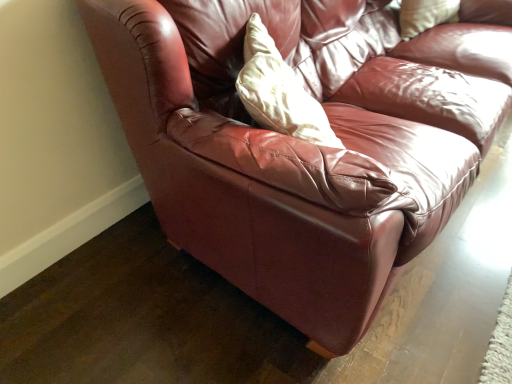
What do you see at coordinates (425, 15) in the screenshot? I see `white soft pillow at upper right` at bounding box center [425, 15].

You are a GUI agent. You are given a task and a screenshot of the screen. Output one action in this format:
    pyautogui.click(x=<x>, y=<y>)
    Task: Click on the white soft pillow at upper right
    This screenshot has width=512, height=384.
    Given the screenshot: What is the action you would take?
    pos(425,15)

Where is `white soft pillow at upper right`? This screenshot has width=512, height=384. white soft pillow at upper right is located at coordinates (425, 15).